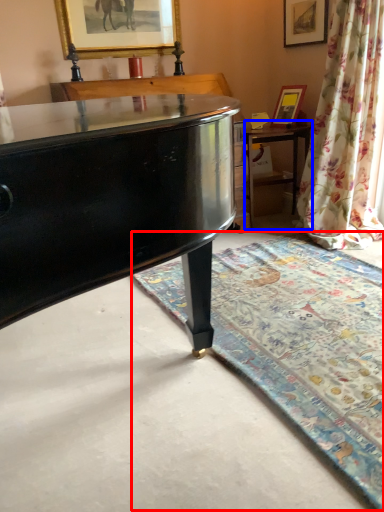
Question: Which object is further to the camera taking this photo, mat (highlighted by a red box) or table (highlighted by a blue box)?

Choices:
 (A) mat
 (B) table

Answer: (B)